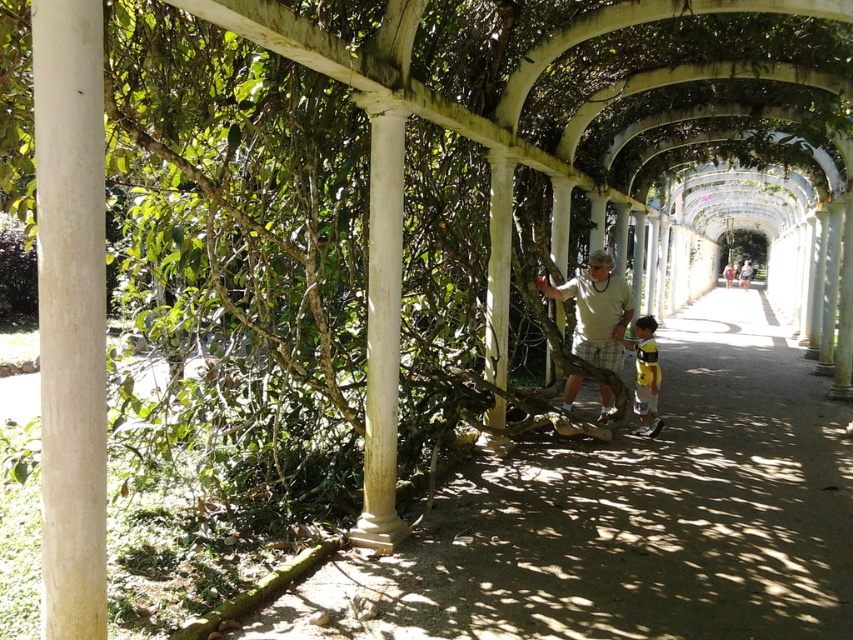
Is smooth concrete path at center to the right of yellow fabric shirt at center from the viewer's perspective?

Yes, smooth concrete path at center is to the right of yellow fabric shirt at center.

Between point (422, 541) and point (654, 408), which one is positioned in front?

Point (422, 541) is more forward.

Between point (289, 630) and point (639, 349), which one is positioned in front?

Positioned in front is point (289, 630).

This screenshot has height=640, width=853. I want to click on smooth concrete path at center, so click(628, 518).

Is smooth concrete path at center to the left of light brown plaid shorts at center from the viewer's perspective?

No, smooth concrete path at center is not to the left of light brown plaid shorts at center.

Identify the location of smooth concrete path at center. (628, 518).

Does point (635, 609) come farther from viewer compared to point (624, 300)?

No, it is in front of (624, 300).

This screenshot has height=640, width=853. I want to click on smooth concrete path at center, so click(x=628, y=518).

Can you confirm if white smooth column at left is positioned to the right of light brown plaid shorts at center?

Result: Incorrect, white smooth column at left is not on the right side of light brown plaid shorts at center.

Can you confirm if white smooth column at left is thinner than light brown plaid shorts at center?

Indeed, white smooth column at left has a lesser width compared to light brown plaid shorts at center.

Is point (33, 12) farther from camera compared to point (613, 332)?

No.

Identify the location of white smooth column at left. This screenshot has height=640, width=853. (70, 314).